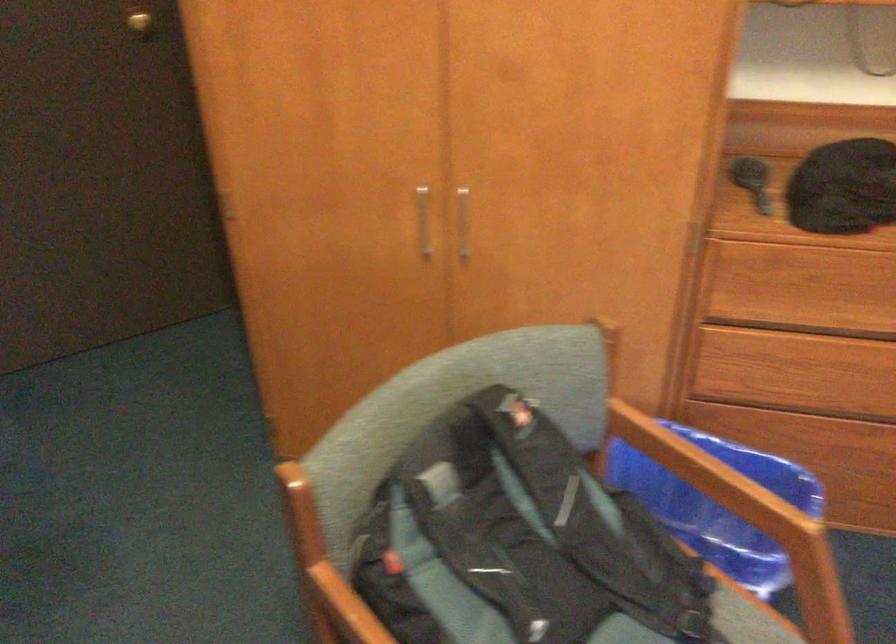
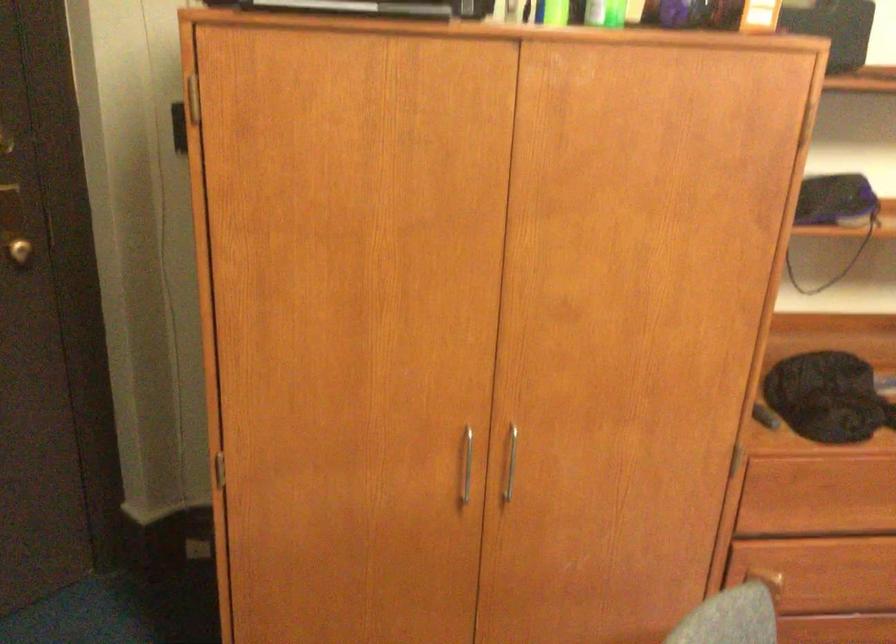
Find the pixel in the second image that matches (x=435, y=216) in the first image.

(466, 465)